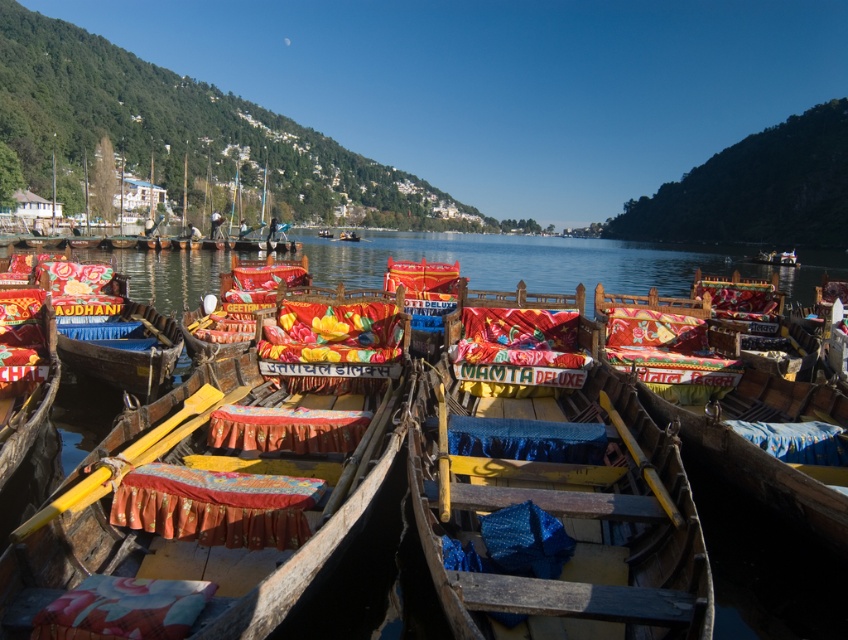
Question: From the image, what is the correct spatial relationship of wooden boat at center in relation to transparent water at center?

Choices:
 (A) above
 (B) below

Answer: (B)

Question: Which point is farther to the camera?

Choices:
 (A) wooden boat at center
 (B) transparent water at center

Answer: (B)

Question: Which object is the farthest from the transparent water at center?

Choices:
 (A) matte wooden boat at center
 (B) wooden boat at center

Answer: (A)

Question: In this image, where is matte wooden boat at center located relative to wooden boat at center?

Choices:
 (A) below
 (B) above

Answer: (A)

Question: Is matte wooden boat at center smaller than transparent water at center?

Choices:
 (A) no
 (B) yes

Answer: (B)

Question: Which object is the farthest from the transparent water at center?

Choices:
 (A) wooden boat at center
 (B) matte wooden boat at center

Answer: (B)